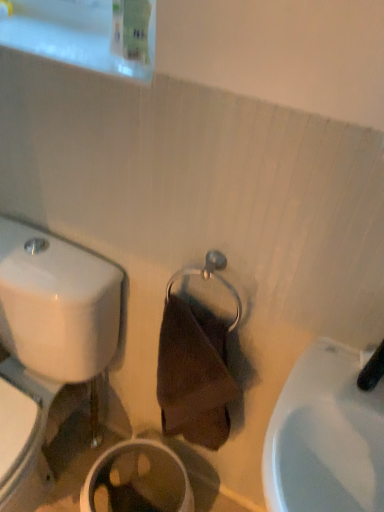
Question: Is white glossy sink at lower right a part of white glossy toilet at left?

Choices:
 (A) yes
 (B) no

Answer: (B)

Question: Is white glossy toilet at left outside of white glossy sink at lower right?

Choices:
 (A) no
 (B) yes

Answer: (B)

Question: Is white glossy sink at lower right at the back of white glossy toilet at left?

Choices:
 (A) yes
 (B) no

Answer: (B)

Question: From the image's perspective, is white glossy toilet at left under white glossy sink at lower right?

Choices:
 (A) yes
 (B) no

Answer: (B)

Question: Is white glossy toilet at left bigger than white glossy sink at lower right?

Choices:
 (A) yes
 (B) no

Answer: (A)

Question: Based on their positions, is white glossy sink at lower right located to the left or right of white glossy toilet at left?

Choices:
 (A) left
 (B) right

Answer: (B)

Question: Looking at their shapes, would you say white glossy sink at lower right is wider or thinner than white glossy toilet at left?

Choices:
 (A) wide
 (B) thin

Answer: (B)

Question: Is point (306, 450) positioned closer to the camera than point (79, 315)?

Choices:
 (A) farther
 (B) closer

Answer: (B)

Question: Considering the positions of white glossy sink at lower right and white glossy toilet at left in the image, is white glossy sink at lower right taller or shorter than white glossy toilet at left?

Choices:
 (A) short
 (B) tall

Answer: (B)

Question: Relative to white glossy sink at lower right, is white glossy toilet at left in front or behind?

Choices:
 (A) behind
 (B) front

Answer: (A)

Question: Looking at the image, does white glossy toilet at left seem bigger or smaller compared to white glossy sink at lower right?

Choices:
 (A) small
 (B) big

Answer: (B)

Question: Considering the positions of white glossy toilet at left and white glossy sink at lower right in the image, is white glossy toilet at left wider or thinner than white glossy sink at lower right?

Choices:
 (A) thin
 (B) wide

Answer: (B)

Question: From a real-world perspective, relative to white glossy sink at lower right, is white glossy toilet at left vertically above or below?

Choices:
 (A) above
 (B) below

Answer: (B)

Question: Is point (379, 348) positioned closer to the camera than point (31, 441)?

Choices:
 (A) closer
 (B) farther

Answer: (A)

Question: From their relative heights in the image, would you say black rubber faucet at upper right is taller or shorter than white glossy toilet at left?

Choices:
 (A) tall
 (B) short

Answer: (B)